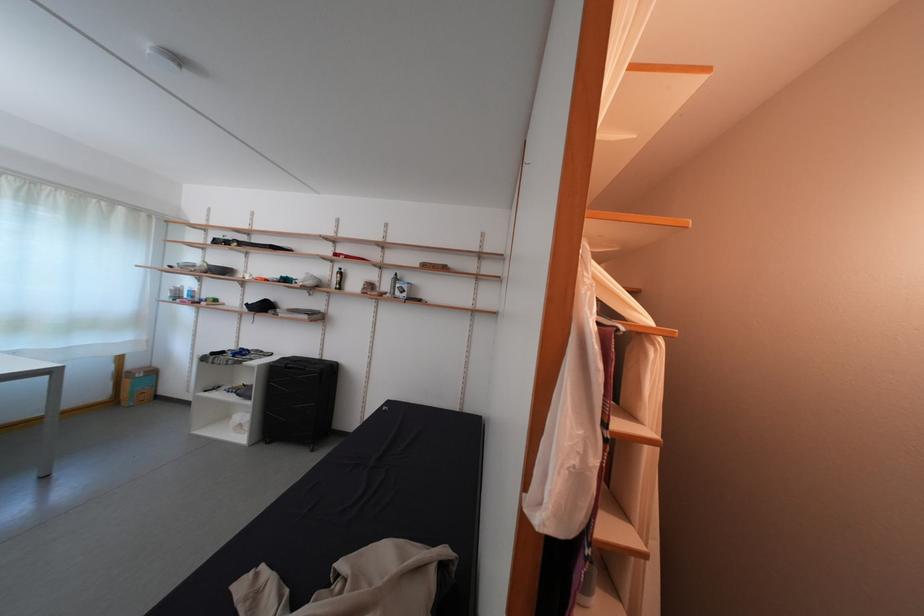
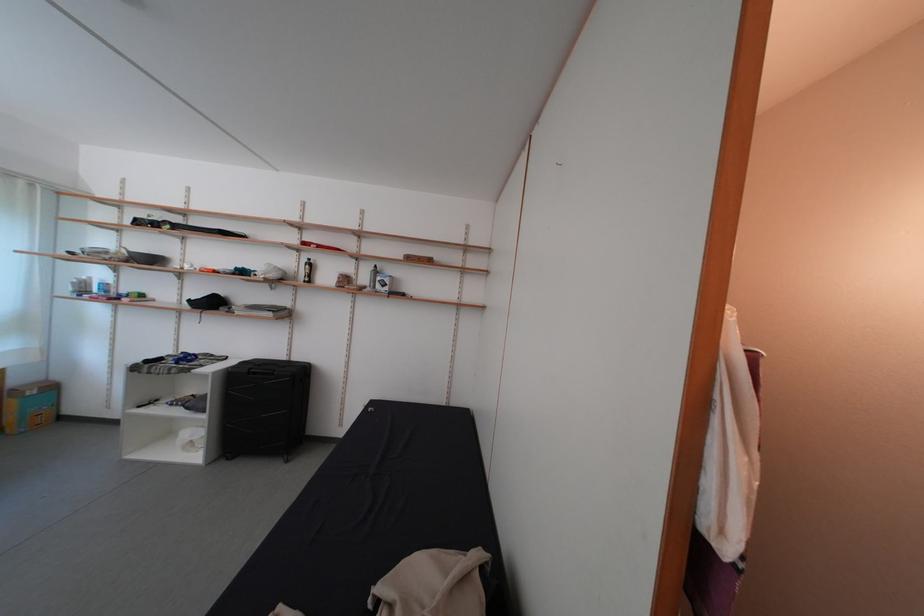
Question: Which direction would the cameraman need to move to produce the second image? Reply with the corresponding letter.

Choices:
 (A) Left
 (B) Right
 (C) Forward
 (D) Backward

Answer: (A)